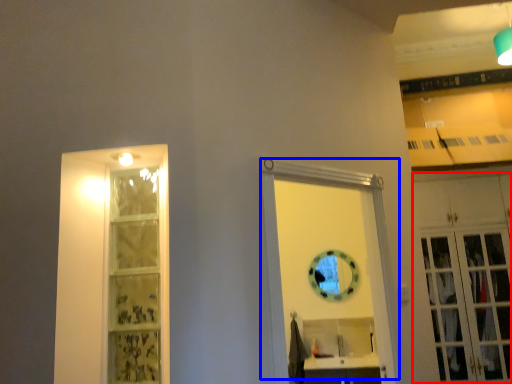
Question: Which object is closer to the camera taking this photo, cabinetry (highlighted by a red box) or door (highlighted by a blue box)?

Choices:
 (A) cabinetry
 (B) door

Answer: (B)